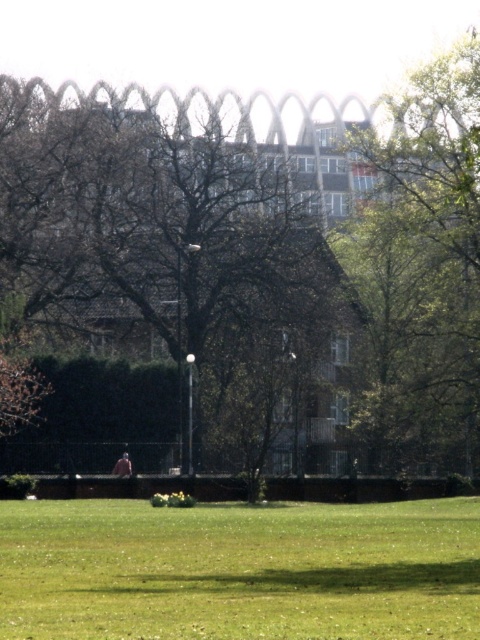
From the picture: Does green leafy tree at upper right appear under light brown fabric person at center?

No, green leafy tree at upper right is not below light brown fabric person at center.

Consider the image. Who is positioned more to the right, green leafy tree at upper right or light brown fabric person at center?

green leafy tree at upper right is more to the right.

Image resolution: width=480 pixels, height=640 pixels. Identify the location of green leafy tree at upper right. (420, 273).

Between green grass at lower center and light brown fabric person at center, which one appears on the right side from the viewer's perspective?

From the viewer's perspective, green grass at lower center appears more on the right side.

Between green grass at lower center and light brown fabric person at center, which one appears on the left side from the viewer's perspective?

From the viewer's perspective, light brown fabric person at center appears more on the left side.

Which is in front, point (167, 516) or point (121, 465)?

Point (167, 516) is more forward.

Find the location of `green grass at lower center`. green grass at lower center is located at coordinates (240, 570).

Measure the distance from green grass at lower center to green leafy tree at upper right.

A distance of 18.40 meters exists between green grass at lower center and green leafy tree at upper right.

Between green grass at lower center and green leafy tree at upper right, which one has more height?

green leafy tree at upper right

You are a GUI agent. You are given a task and a screenshot of the screen. Output one action in this format:
    pyautogui.click(x=<x>, y=<y>)
    Task: Click on the green grass at lower center
    
    Given the screenshot: What is the action you would take?
    pyautogui.click(x=240, y=570)